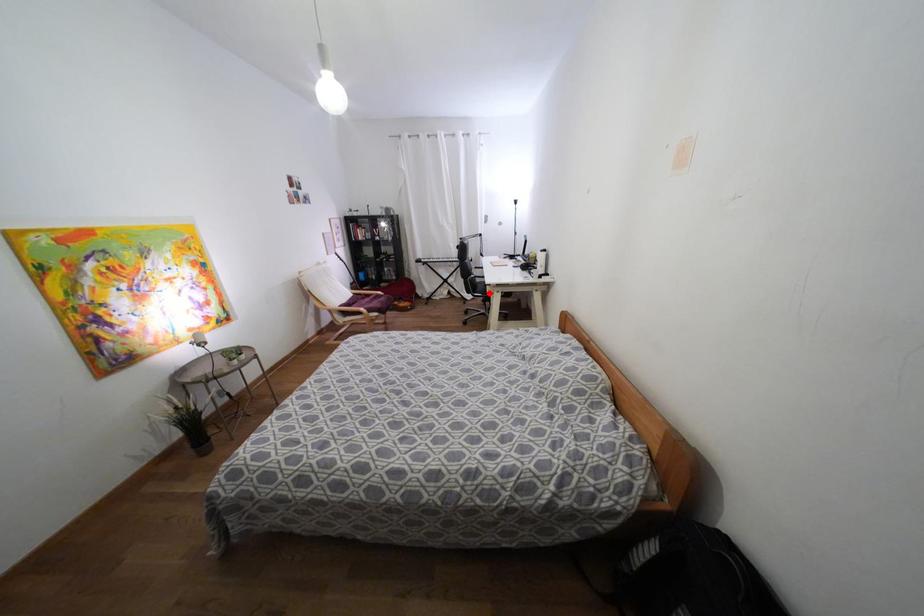
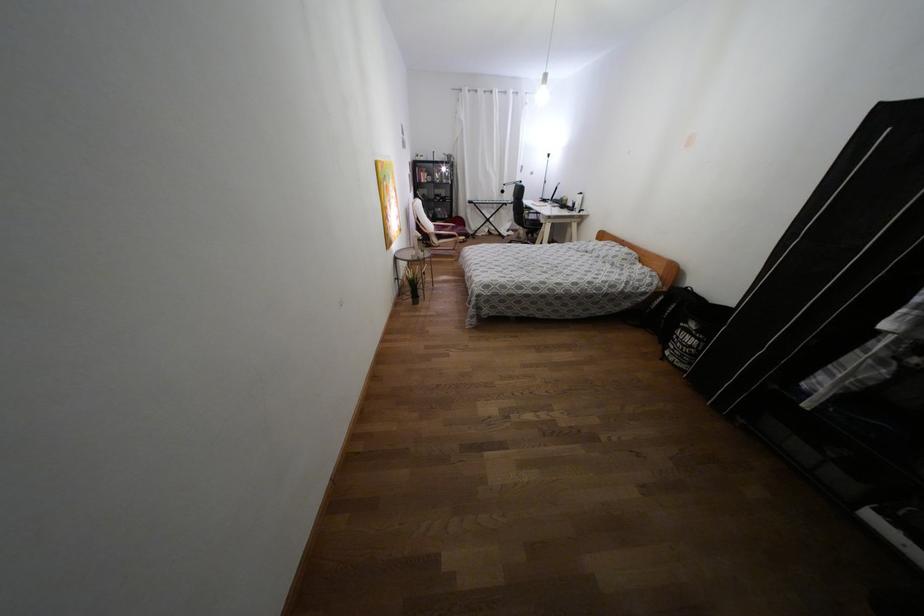
Question: I am providing you with two images of the same scene from different viewpoints. A red point is marked on the first image. At the location where the point appears in image 1, is it still visible in image 2?

Choices:
 (A) Yes
 (B) No

Answer: (A)